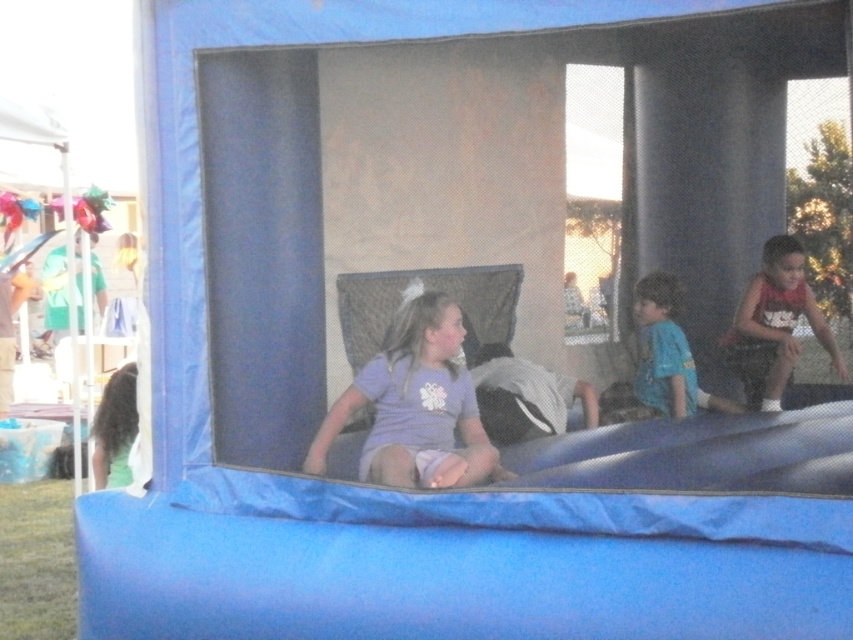
You are standing at the center of the blue inflatable structure and want to exit through the nearest exit. The exit is located at point (415, 404). Which direction should you move to reach the exit?

The exit is located at point (415, 404), which is on the purple matte shirt at center. Therefore, you should move towards the purple matte shirt at center to reach the exit.

You are a photographer at the event and need to capture a photo where both the purple matte shirt at center and the blue cotton shirt at center are visible. Based on their heights, which child should be positioned closer to the front to ensure both are fully visible in the frame?

The purple matte shirt at center is shorter than the blue cotton shirt at center. To ensure both are fully visible, the purple matte shirt at center should be positioned closer to the front so that the taller blue cotton shirt at center doesn not block the view.